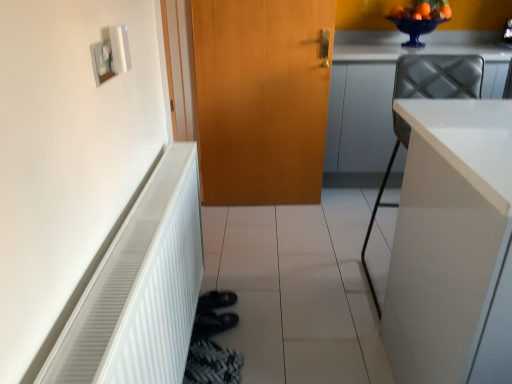
Where is `vacant area to the right of wooden door at center`? This screenshot has height=384, width=512. vacant area to the right of wooden door at center is located at coordinates (327, 213).